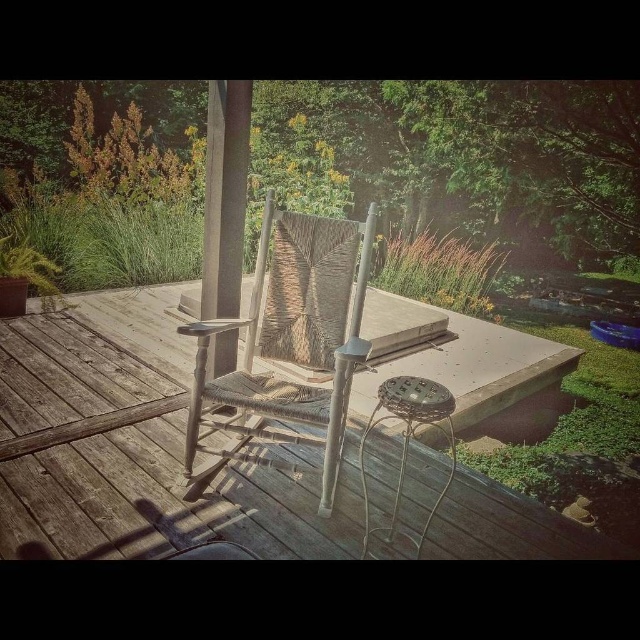
You are standing on the weathered wood deck at center and want to place a small potted plant. The coordinates of the deck are given as point (x=134, y=445). Where should you place the plant to ensure it is centered on the deck?

The point (x=134, y=445) marks the center of the weathered wood deck at center, so placing the plant at this coordinate will center it on the deck.

You are standing at the edge of the deck and want to move towards the woven wood chair at center. If your stride length is 2.5 feet per step, how many steps will it take you to reach the chair?

The distance between you and the woven wood chair at center is 6.87 feet. With each step covering 2.5 feet, dividing 6.87 by 2.5 gives approximately 2.75 steps. Since you can only take whole steps, you would need 3 steps to reach the woven wood chair at center.